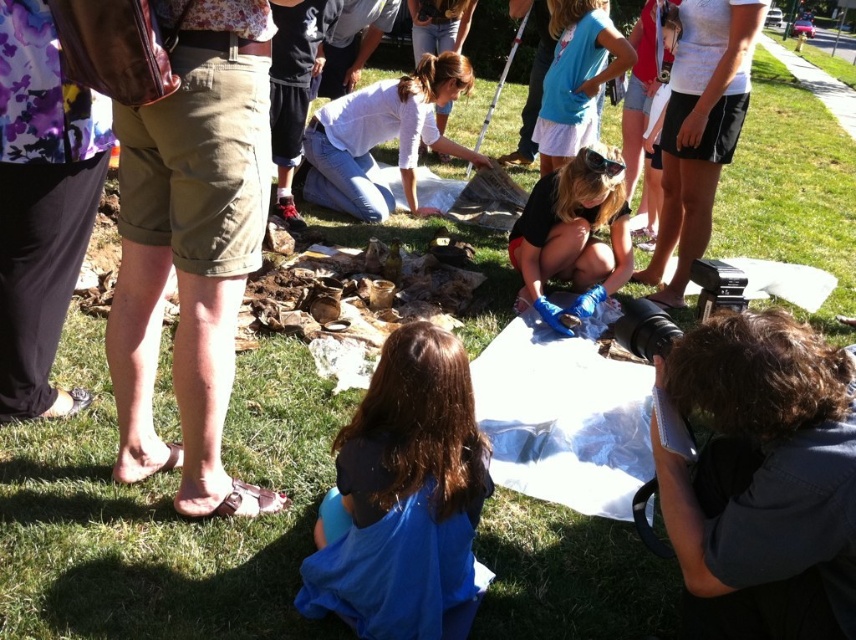
Question: Among these objects, which one is nearest to the camera?

Choices:
 (A) blue latex gloves at center
 (B) dark curly hair at lower right
 (C) dark brown hair at lower center

Answer: (B)

Question: Is dark curly hair at lower right smaller than dark brown hair at lower center?

Choices:
 (A) no
 (B) yes

Answer: (B)

Question: In this image, where is white cotton shirt at center located relative to blue latex gloves at center?

Choices:
 (A) below
 (B) above

Answer: (B)

Question: Where is dark curly hair at lower right located in relation to dark brown hair at lower center in the image?

Choices:
 (A) right
 (B) left

Answer: (A)

Question: Which is nearer to the dark brown hair at lower center?

Choices:
 (A) white cotton shirt at center
 (B) dark curly hair at lower right

Answer: (B)

Question: Which point is farther from the camera taking this photo?

Choices:
 (A) (393, 596)
 (B) (632, 260)
 (C) (724, 380)

Answer: (B)